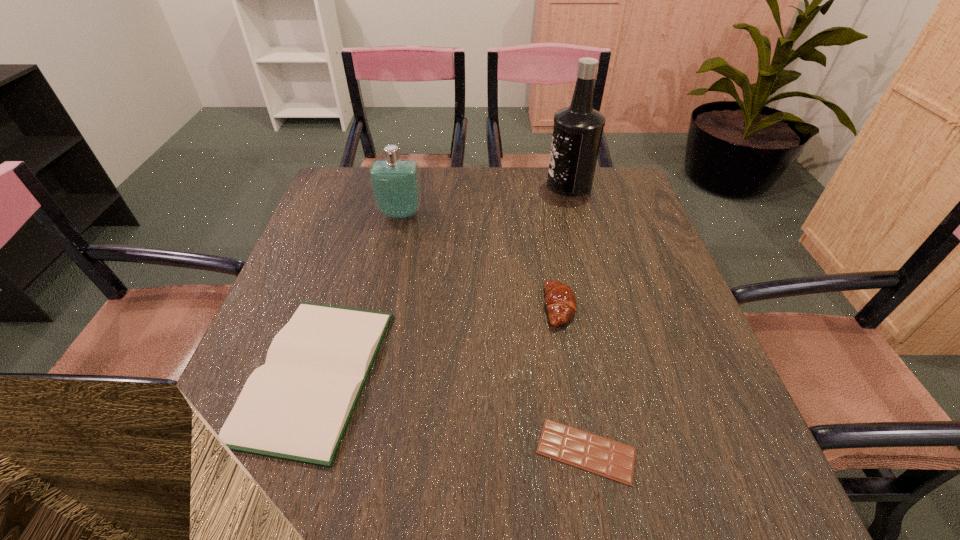
What are the coordinates of `free space located 0.290m on the front label of the fourth shortest object` in the screenshot? It's located at (382, 299).

I want to click on free space located on the right of the third tallest object, so click(x=620, y=307).

This screenshot has height=540, width=960. In order to click on vacant region located on the right of the second shortest object in this screenshot , I will do `click(495, 374)`.

At what (x,y) coordinates should I click in order to perform the action: click on free space located on the left of the shortest object. Please return your answer as a coordinate pair (x, y). The height and width of the screenshot is (540, 960). Looking at the image, I should click on (470, 451).

At what (x,y) coordinates should I click in order to perform the action: click on liquor positioned at the far edge. Please return your answer as a coordinate pair (x, y). Looking at the image, I should click on (577, 132).

At what (x,y) coordinates should I click in order to perform the action: click on perfume at the far edge. Please return your answer as a coordinate pair (x, y). Looking at the image, I should click on 395,183.

Image resolution: width=960 pixels, height=540 pixels. In order to click on hardback book situated at the near edge in this screenshot , I will do `click(297, 406)`.

You are a GUI agent. You are given a task and a screenshot of the screen. Output one action in this format:
    pyautogui.click(x=<x>, y=<y>)
    Task: Click on the chocolate bar that is at the near edge
    This screenshot has width=960, height=540.
    Given the screenshot: What is the action you would take?
    pyautogui.click(x=590, y=452)

The height and width of the screenshot is (540, 960). Find the location of `object that is at the left edge`. object that is at the left edge is located at coordinates (297, 406).

The image size is (960, 540). Find the location of `object that is at the right edge`. object that is at the right edge is located at coordinates (577, 132).